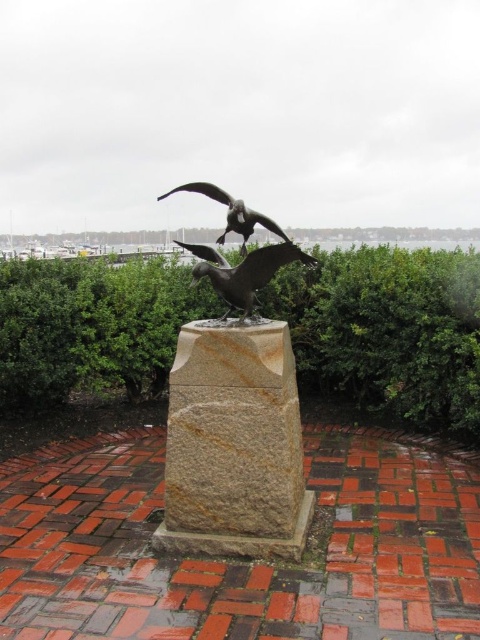
Between brown granite pedestal at center and polished bronze bird at center, which one appears on the left side from the viewer's perspective?

Positioned to the left is polished bronze bird at center.

Can you confirm if brown granite pedestal at center is positioned to the right of polished bronze bird at center?

Yes, brown granite pedestal at center is to the right of polished bronze bird at center.

Between point (242, 545) and point (230, 212), which one is positioned behind?

The point (230, 212) is more distant.

Locate an element on the screen. brown granite pedestal at center is located at coordinates (233, 444).

Which of these two, green leafy hedge at center or polished bronze bird at center, stands shorter?

polished bronze bird at center

Does green leafy hedge at center appear over polished bronze bird at center?

Incorrect, green leafy hedge at center is not positioned above polished bronze bird at center.

Find the location of a particular element. The image size is (480, 640). green leafy hedge at center is located at coordinates (387, 330).

Identify the location of green leafy hedge at center. (387, 330).

Which is in front, point (7, 301) or point (222, 355)?

Point (222, 355) is more forward.

Which of these two, green leafy hedge at center or brown granite pedestal at center, stands taller?

Standing taller between the two is green leafy hedge at center.

Is point (28, 269) in front of point (262, 403)?

No, it is not.

Locate an element on the screen. This screenshot has height=640, width=480. green leafy hedge at center is located at coordinates [387, 330].